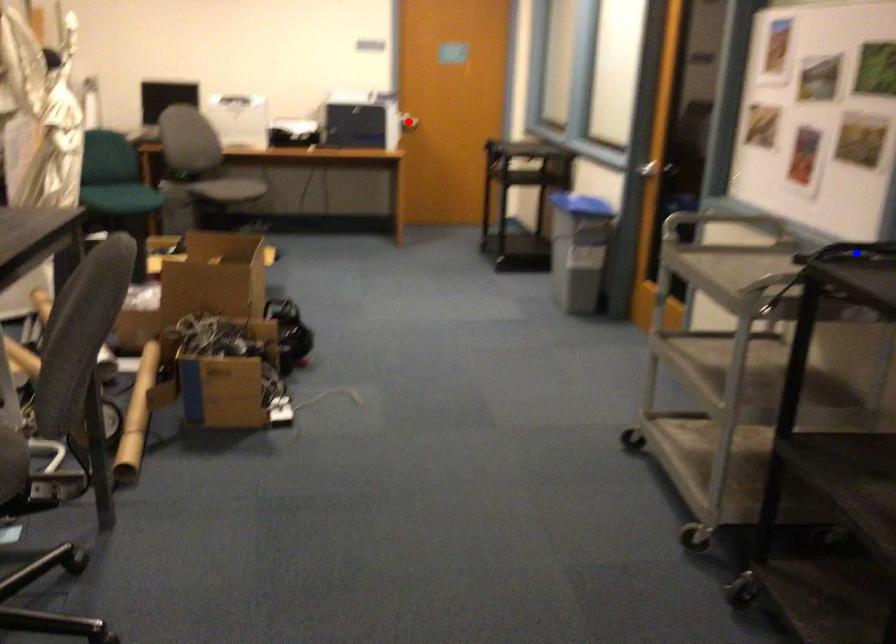
Question: Two points are marked on the image. Which point is closer to the camera?

Choices:
 (A) Blue point is closer.
 (B) Red point is closer.

Answer: (A)